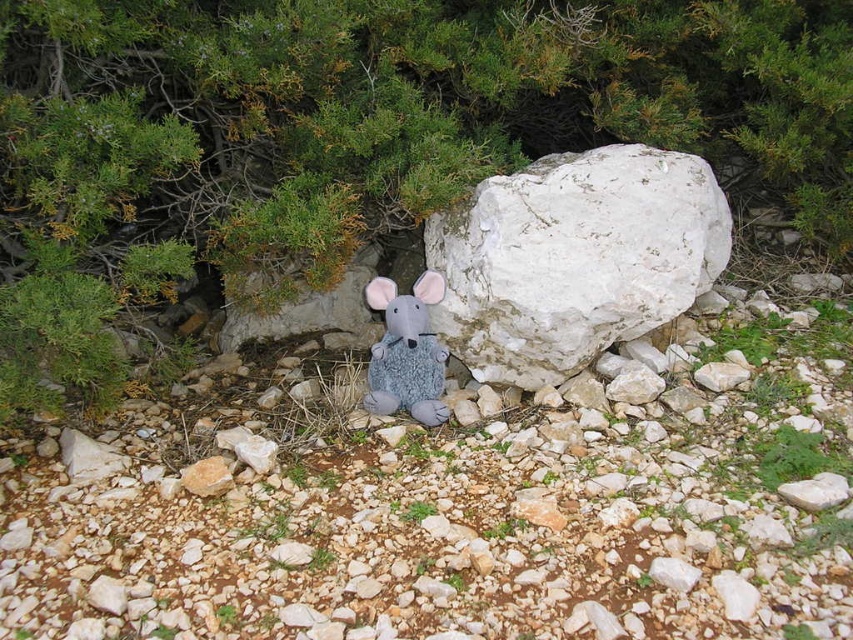
Question: Can you confirm if green leafy tree at upper center is positioned to the left of fuzzy gray plush mouse at center?

Choices:
 (A) no
 (B) yes

Answer: (A)

Question: Which point is farther from the camera taking this photo?

Choices:
 (A) (451, 326)
 (B) (378, 372)

Answer: (A)

Question: Which point is closer to the camera?

Choices:
 (A) white rough rock at center
 (B) green leafy tree at upper center

Answer: (B)

Question: Which point is closer to the camera taking this photo?

Choices:
 (A) (527, 348)
 (B) (173, 262)
 (C) (395, 312)

Answer: (B)

Question: Is white rough rock at center bigger than fuzzy gray plush mouse at center?

Choices:
 (A) no
 (B) yes

Answer: (B)

Question: Is green leafy tree at upper center positioned at the back of fuzzy gray plush mouse at center?

Choices:
 (A) yes
 (B) no

Answer: (B)